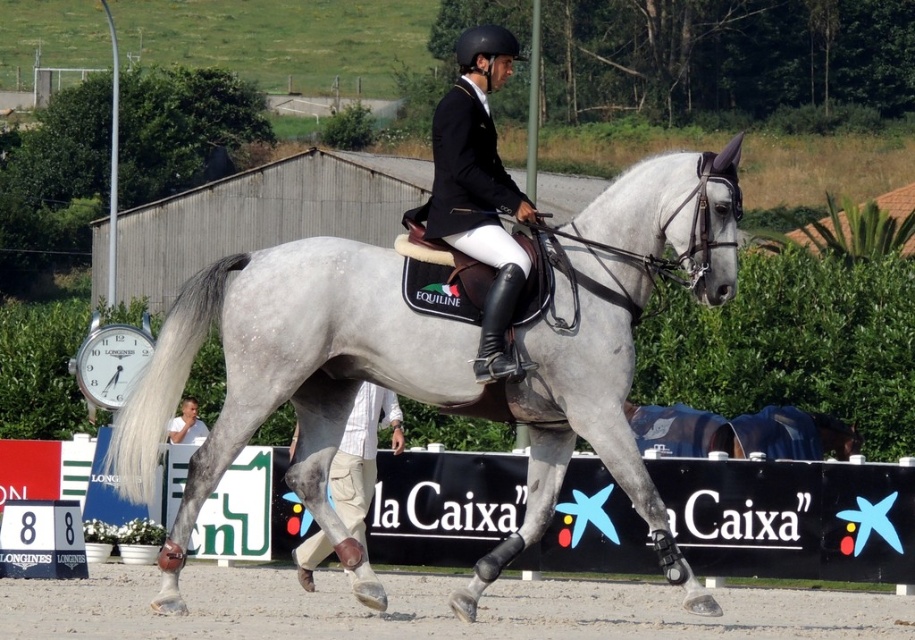
Question: Among these points, which one is farthest from the camera?

Choices:
 (A) (x=281, y=262)
 (B) (x=486, y=221)
 (C) (x=248, y=621)

Answer: (C)

Question: From the image, what is the correct spatial relationship of gray sand at center in relation to black leather jacket at center?

Choices:
 (A) right
 (B) left

Answer: (B)

Question: Is gray matte/suede horse at center to the right of gray sand at center from the viewer's perspective?

Choices:
 (A) no
 (B) yes

Answer: (A)

Question: Estimate the real-world distances between objects in this image. Which object is farther from the gray sand at center?

Choices:
 (A) gray matte/suede horse at center
 (B) black leather jacket at center

Answer: (B)

Question: Is gray matte/suede horse at center positioned in front of gray sand at center?

Choices:
 (A) yes
 (B) no

Answer: (B)

Question: Which point is closer to the camera?

Choices:
 (A) (511, 353)
 (B) (234, 444)

Answer: (A)